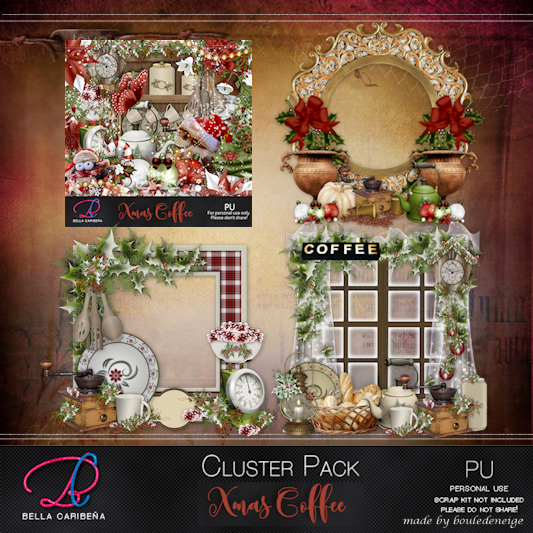
In order to click on white clocks in this screenshot , I will do `click(232, 392)`, `click(446, 269)`, `click(88, 137)`, `click(104, 60)`.